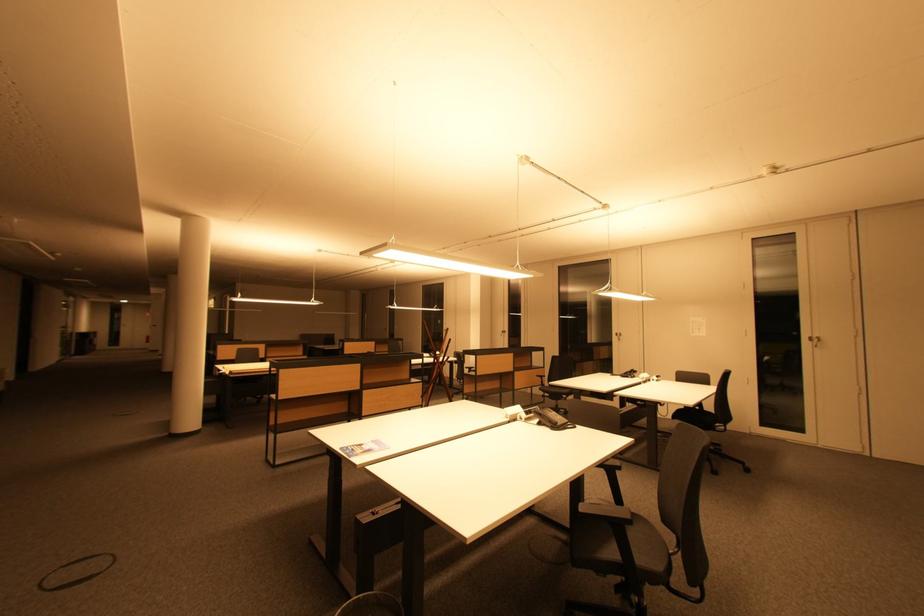
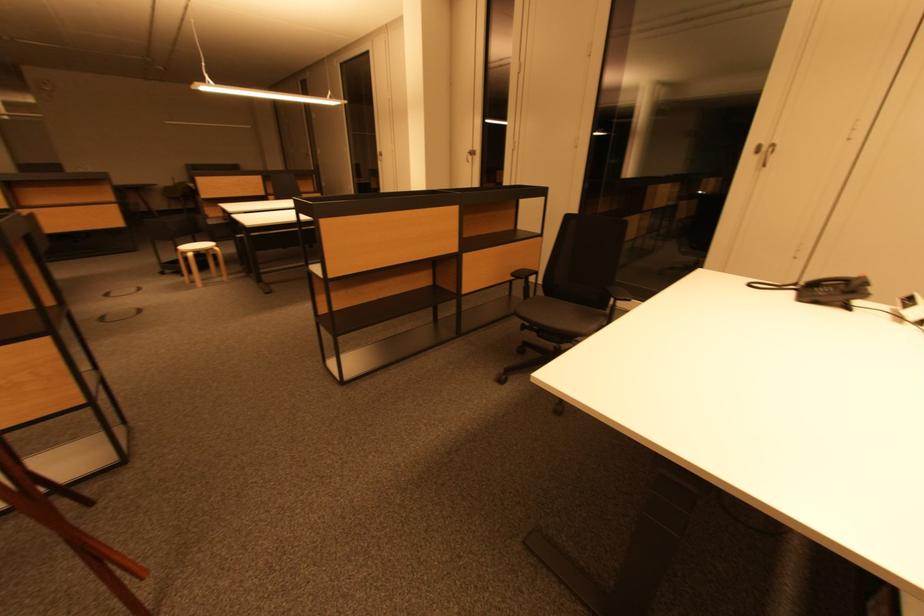
Where in the second image is the point corresponding to pixel 630 376 from the first image?

(819, 286)